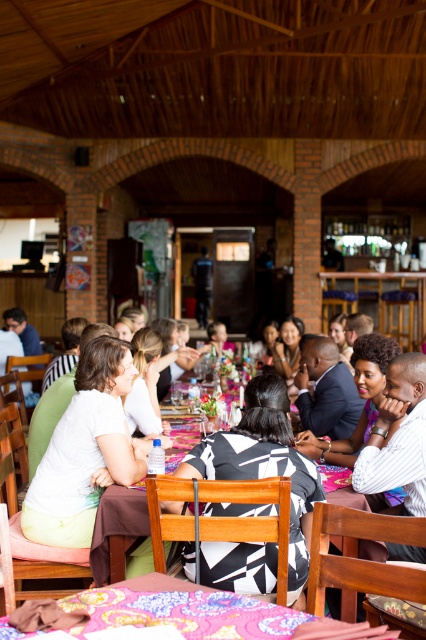
You are standing at the entrance of the event venue and want to find the floral fabric tablecloth at lower center. According to the coordinates given, where should you look to locate it?

The floral fabric tablecloth at lower center is located at point (183, 611).